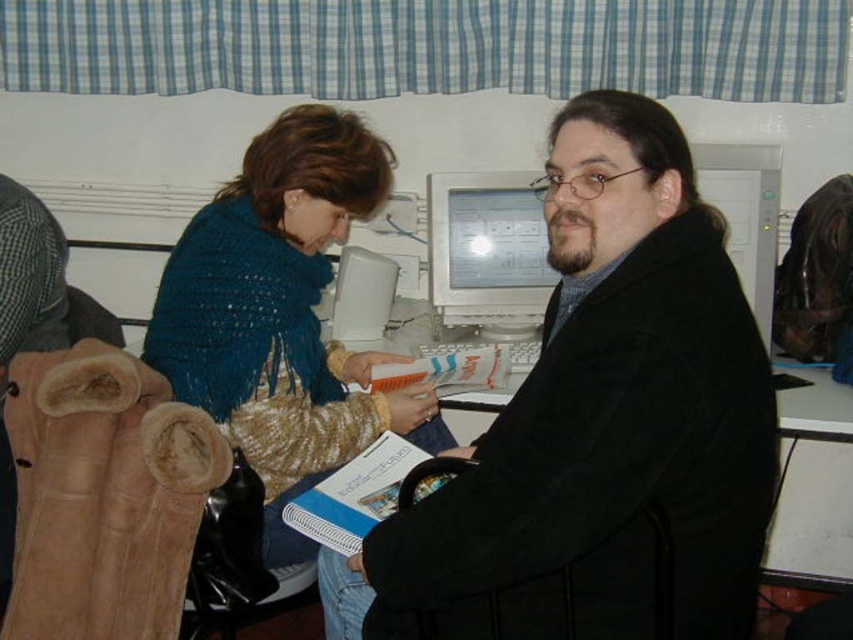
Who is more distant from viewer, [227,230] or [544,253]?

The point [544,253] is behind.

Does point (343, 225) come farther from viewer compared to point (462, 218)?

That is False.

Find the location of `knitted blue scarf at left`. knitted blue scarf at left is located at coordinates (282, 314).

Who is higher up, black matte coat at center or white plastic computer monitor at center?

white plastic computer monitor at center

Does black matte coat at center have a lesser height compared to white plastic computer monitor at center?

No, black matte coat at center is not shorter than white plastic computer monitor at center.

Describe the element at coordinates (599, 428) in the screenshot. Image resolution: width=853 pixels, height=640 pixels. I see `black matte coat at center` at that location.

What are the coordinates of `black matte coat at center` in the screenshot? It's located at (599, 428).

Is point (734, 465) in front of point (316, 408)?

Yes, it is.

Describe the element at coordinates (599, 428) in the screenshot. I see `black matte coat at center` at that location.

You are a GUI agent. You are given a task and a screenshot of the screen. Output one action in this format:
    pyautogui.click(x=<x>, y=<y>)
    Task: Click on the black matte coat at center
    The height and width of the screenshot is (640, 853).
    Given the screenshot: What is the action you would take?
    pyautogui.click(x=599, y=428)